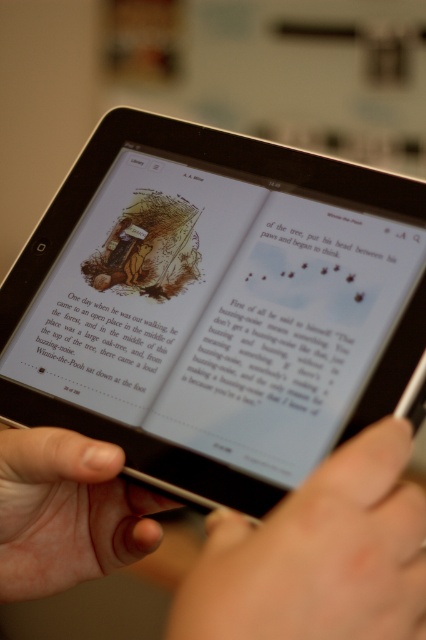
Identify the location of black glossy tablet at center. (216, 307).

Looking at this image, is smooth skin hand at lower center above white paper text at center?

No, smooth skin hand at lower center is not above white paper text at center.

Which is above, smooth skin hand at lower center or white paper text at center?

white paper text at center

Is point (370, 481) positioned behind point (48, 326)?

No, it is not.

At what (x,y) coordinates should I click in order to perform the action: click on smooth skin hand at lower center. Please return your answer as a coordinate pair (x, y). The height and width of the screenshot is (640, 426). Looking at the image, I should click on click(317, 556).

Does black glossy tablet at center appear on the right side of white paper text at center?

Yes, black glossy tablet at center is to the right of white paper text at center.

Is black glossy tablet at center thinner than white paper text at center?

Incorrect, black glossy tablet at center's width is not less than white paper text at center's.

In the scene shown: Measure the distance between point [365,301] and camera.

Point [365,301] is 17.48 inches away from camera.

Find the location of a particular element. This screenshot has width=426, height=640. black glossy tablet at center is located at coordinates (216, 307).